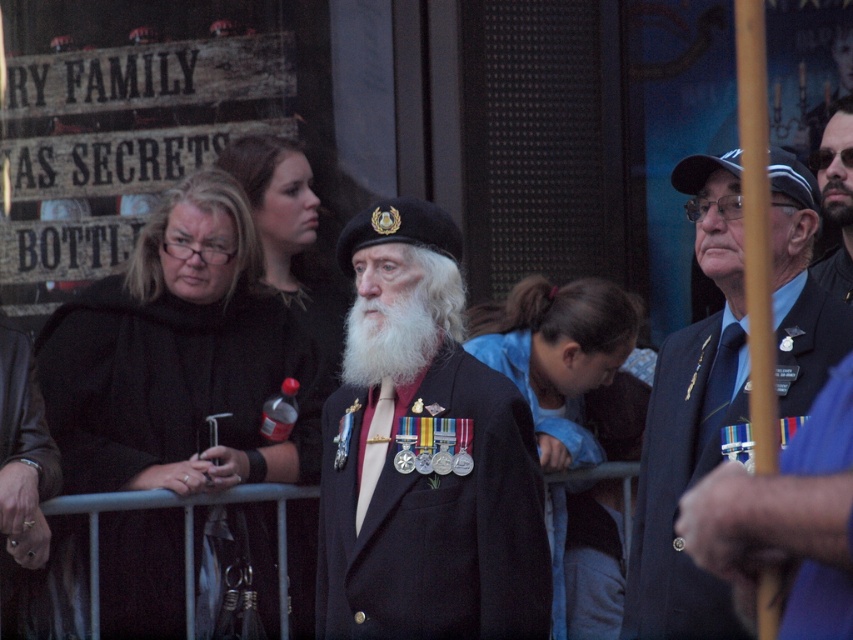
Does dark blue fabric jacket at center have a smaller size compared to bearded man at center?

Actually, dark blue fabric jacket at center might be larger than bearded man at center.

Who is shorter, dark blue fabric jacket at center or bearded man at center?

bearded man at center is shorter.

Identify the location of dark blue fabric jacket at center. (532, 392).

This screenshot has height=640, width=853. I want to click on dark blue fabric jacket at center, so click(532, 392).

Is black matte coat at center to the right of dark blue fabric jacket at center from the viewer's perspective?

No, black matte coat at center is not to the right of dark blue fabric jacket at center.

Between point (144, 593) and point (549, 536), which one is positioned behind?

The point (549, 536) is behind.

I want to click on black matte coat at center, so click(167, 380).

Looking at this image, does dark blue wool jacket at center have a greater height compared to bearded man at center?

Indeed, dark blue wool jacket at center has a greater height compared to bearded man at center.

Is point (428, 259) more distant than point (849, 124)?

No, (428, 259) is closer to viewer.

At what (x,y) coordinates should I click in order to perform the action: click on dark blue wool jacket at center. Please return your answer as a coordinate pair (x, y). Image resolution: width=853 pixels, height=640 pixels. Looking at the image, I should click on (415, 467).